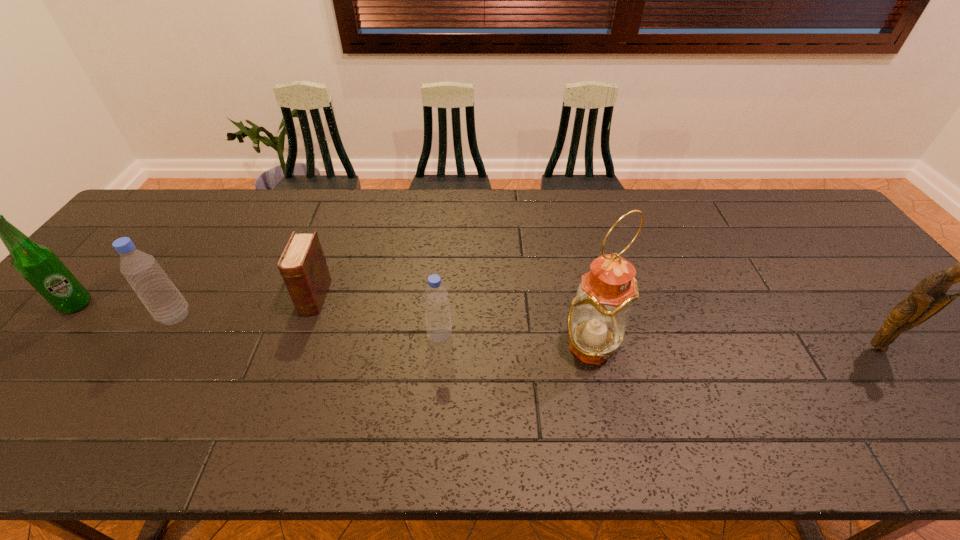
The image size is (960, 540). Find the location of `vacant area in the image that satisfies the following two spatial constraints: 1. on the spine side of the third object from right to left; 2. on the left side of the diary`. vacant area in the image that satisfies the following two spatial constraints: 1. on the spine side of the third object from right to left; 2. on the left side of the diary is located at coordinates (300, 336).